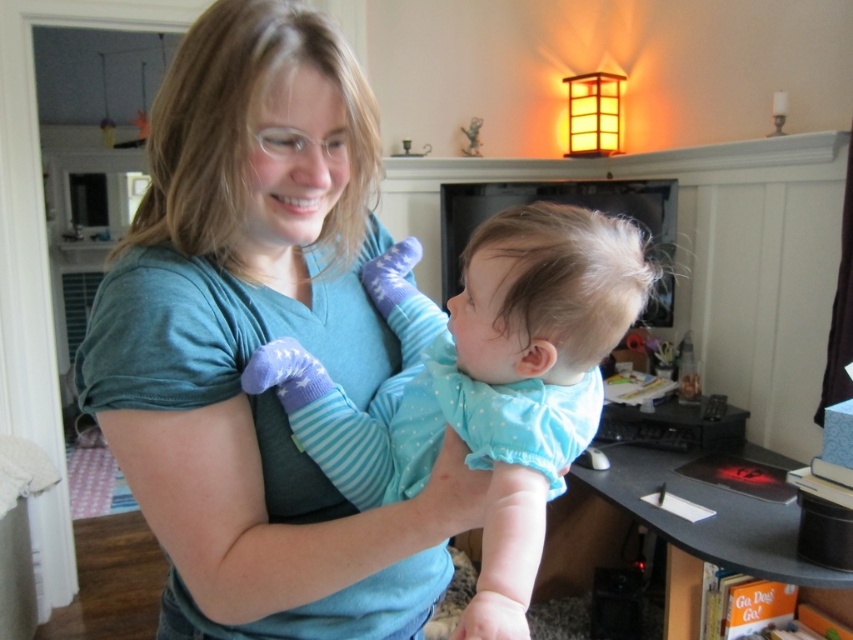
You are standing in the living room and want to place a small decorative item above the fireplace. There are two points marked in the room at coordinates point (170,216) and point (521,356). Which point is closer to the fireplace?

Point (170,216) is behind point (521,356), so the point closer to the fireplace would be point (521,356).